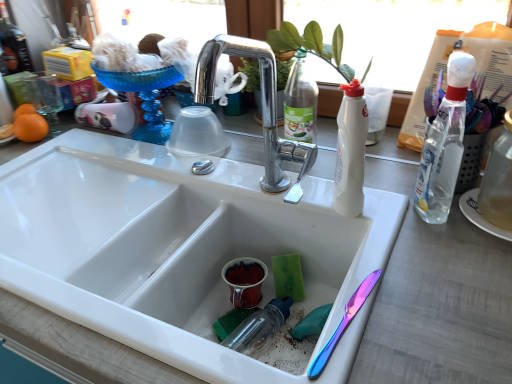
Image resolution: width=512 pixels, height=384 pixels. Identify the location of unoccupied area behind clear plastic bottle at right, the 2th bottle from the left. (391, 177).